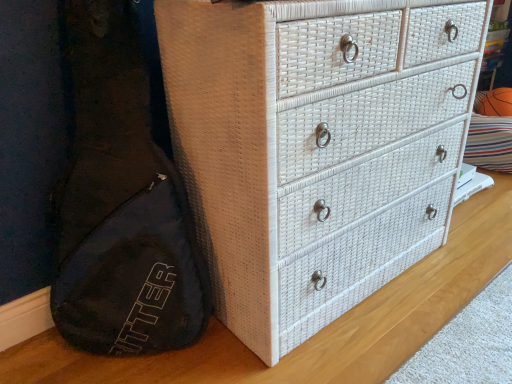
Question: Does white wicker chest of drawers at center come in front of orange rubber basketball at upper right?

Choices:
 (A) no
 (B) yes

Answer: (B)

Question: Can you confirm if white wicker chest of drawers at center is wider than orange rubber basketball at upper right?

Choices:
 (A) no
 (B) yes

Answer: (B)

Question: Is white wicker chest of drawers at center facing away from orange rubber basketball at upper right?

Choices:
 (A) yes
 (B) no

Answer: (B)

Question: Can you confirm if white wicker chest of drawers at center is positioned to the left of orange rubber basketball at upper right?

Choices:
 (A) no
 (B) yes

Answer: (B)

Question: From the image's perspective, would you say white wicker chest of drawers at center is shown under orange rubber basketball at upper right?

Choices:
 (A) no
 (B) yes

Answer: (B)

Question: Does white wicker chest of drawers at center have a larger size compared to orange rubber basketball at upper right?

Choices:
 (A) yes
 (B) no

Answer: (A)

Question: From the image's perspective, would you say orange rubber basketball at upper right is positioned over white wicker chest of drawers at center?

Choices:
 (A) no
 (B) yes

Answer: (B)

Question: From a real-world perspective, does orange rubber basketball at upper right sit lower than white wicker chest of drawers at center?

Choices:
 (A) no
 (B) yes

Answer: (B)

Question: Does orange rubber basketball at upper right appear on the left side of white wicker chest of drawers at center?

Choices:
 (A) yes
 (B) no

Answer: (B)

Question: From a real-world perspective, is orange rubber basketball at upper right physically above white wicker chest of drawers at center?

Choices:
 (A) yes
 (B) no

Answer: (B)

Question: Is orange rubber basketball at upper right next to white wicker chest of drawers at center?

Choices:
 (A) yes
 (B) no

Answer: (B)

Question: Considering the relative sizes of orange rubber basketball at upper right and white wicker chest of drawers at center in the image provided, is orange rubber basketball at upper right bigger than white wicker chest of drawers at center?

Choices:
 (A) yes
 (B) no

Answer: (B)

Question: From the image's perspective, is orange rubber basketball at upper right above or below white wicker chest of drawers at center?

Choices:
 (A) below
 (B) above

Answer: (B)